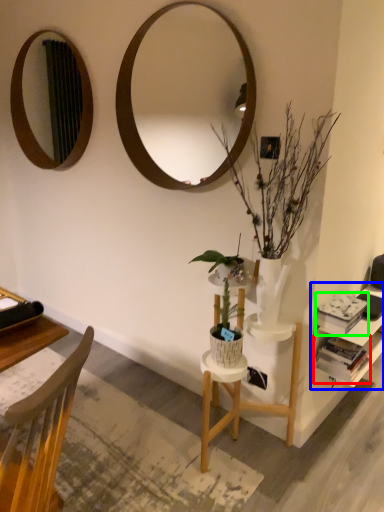
Question: Estimate the real-world distances between objects in this image. Which object is farther from book (highlighted by a red box), shelf (highlighted by a blue box) or book (highlighted by a green box)?

Choices:
 (A) shelf
 (B) book

Answer: (B)